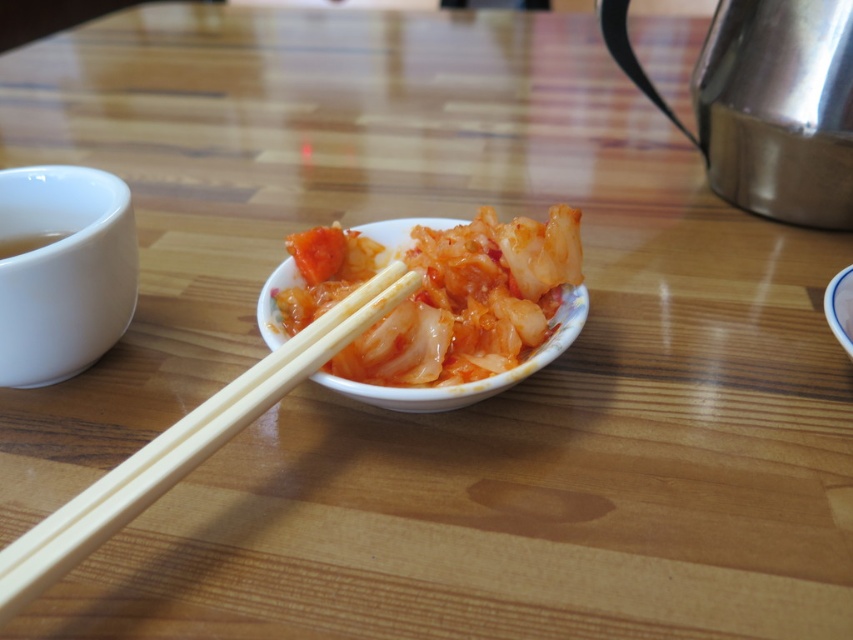
Who is taller, shiny orange kimchi at center or white glossy bowl at center?

shiny orange kimchi at center is taller.

Locate an element on the screen. The width and height of the screenshot is (853, 640). shiny orange kimchi at center is located at coordinates (469, 301).

This screenshot has width=853, height=640. I want to click on shiny orange kimchi at center, so click(x=469, y=301).

Who is positioned more to the left, shiny metallic kettle at upper right or wooden chopsticks at center?

wooden chopsticks at center is more to the left.

Is shiny metallic kettle at upper right taller than wooden chopsticks at center?

Correct, shiny metallic kettle at upper right is much taller as wooden chopsticks at center.

Which is in front, point (643, 81) or point (138, 476)?

Point (138, 476)

Locate an element on the screen. The image size is (853, 640). shiny metallic kettle at upper right is located at coordinates (767, 104).

Between shiny orange kimchi at center and white ceramic bowl at left, which one is positioned higher?

white ceramic bowl at left is higher up.

Is shiny orange kimchi at center to the right of white ceramic bowl at left from the viewer's perspective?

Indeed, shiny orange kimchi at center is positioned on the right side of white ceramic bowl at left.

Between point (538, 236) and point (38, 225), which one is positioned behind?

Positioned behind is point (38, 225).

Image resolution: width=853 pixels, height=640 pixels. Find the location of `shiny orange kimchi at center`. shiny orange kimchi at center is located at coordinates (469, 301).